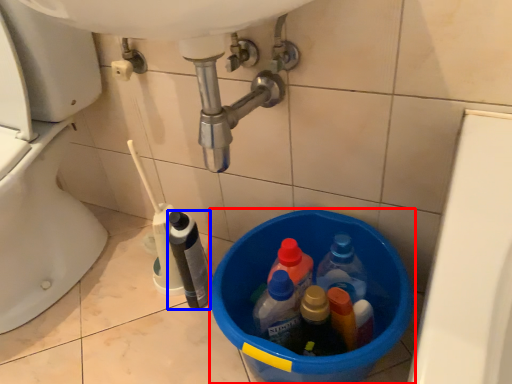
Question: Which object appears closest to the camera in this image, basin (highlighted by a red box) or bottle (highlighted by a blue box)?

Choices:
 (A) basin
 (B) bottle

Answer: (A)